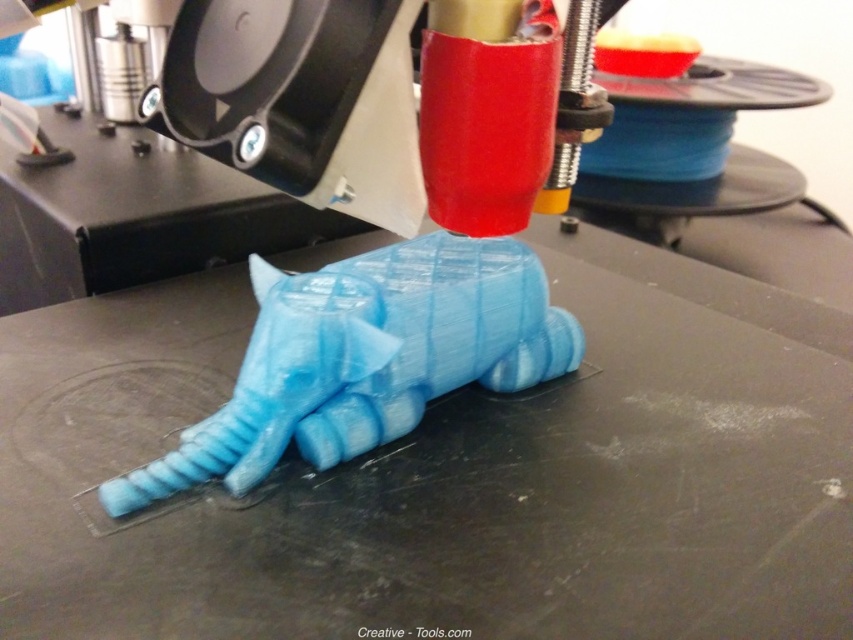
Question: Does blue matte elephant at center appear on the right side of blue glossy elephant at center?

Choices:
 (A) no
 (B) yes

Answer: (B)

Question: Which object is closer to the camera taking this photo?

Choices:
 (A) blue matte elephant at center
 (B) blue glossy elephant at center

Answer: (A)

Question: Which point is farther to the camera?

Choices:
 (A) blue glossy elephant at center
 (B) blue matte elephant at center

Answer: (A)

Question: Is blue matte elephant at center thinner than blue glossy elephant at center?

Choices:
 (A) no
 (B) yes

Answer: (A)

Question: Is blue matte elephant at center thinner than blue glossy elephant at center?

Choices:
 (A) yes
 (B) no

Answer: (B)